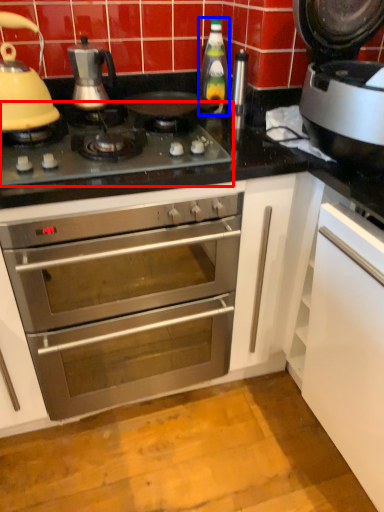
Question: Which object is further to the camera taking this photo, gas stove (highlighted by a red box) or bottle (highlighted by a blue box)?

Choices:
 (A) gas stove
 (B) bottle

Answer: (B)